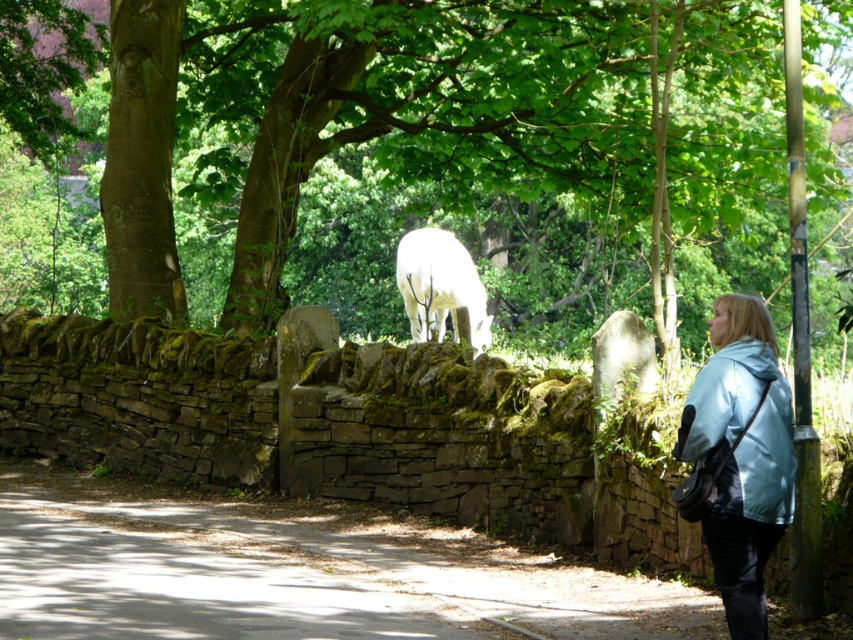
Question: Where is green leafy tree at upper center located in relation to white woolly goat at center in the image?

Choices:
 (A) left
 (B) right

Answer: (B)

Question: Which object appears farthest from the camera in this image?

Choices:
 (A) white woolly goat at center
 (B) green leafy tree at upper center
 (C) dirt path at lower center

Answer: (A)

Question: Does dirt path at lower center appear on the right side of white woolly goat at center?

Choices:
 (A) yes
 (B) no

Answer: (B)

Question: Among these objects, which one is farthest from the camera?

Choices:
 (A) light blue fabric at right
 (B) white woolly goat at center
 (C) green leafy tree at upper center

Answer: (B)

Question: Is green leafy tree at upper center below white woolly goat at center?

Choices:
 (A) yes
 (B) no

Answer: (B)

Question: Which point is farther to the camera?

Choices:
 (A) (172, 589)
 (B) (410, 321)
 (C) (758, 330)

Answer: (B)